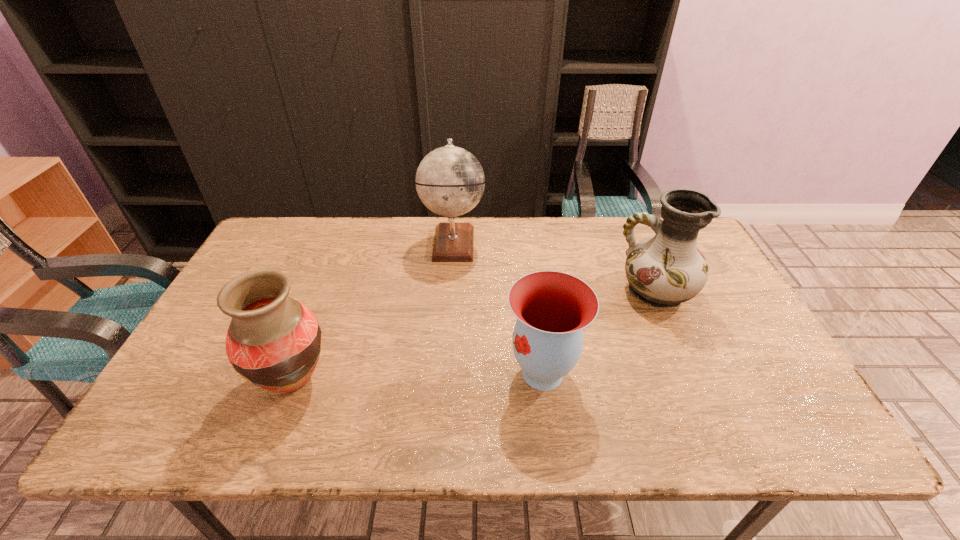
The image size is (960, 540). Identify the location of empty space between the farthest object and the leftmost vase. (373, 312).

Identify the location of vacant point located between the second object from right to left and the third nearest object. (599, 332).

Find the location of `free space between the leftmost vase and the shortest object`. free space between the leftmost vase and the shortest object is located at coordinates [418, 377].

Image resolution: width=960 pixels, height=540 pixels. In order to click on free spot between the leftmost vase and the globe in this screenshot , I will do `click(373, 312)`.

Locate an element on the screen. This screenshot has width=960, height=540. free area in between the shortest object and the rightmost vase is located at coordinates (599, 332).

Find the location of a particular element. vacant space that is in between the second farthest object and the farthest object is located at coordinates (555, 267).

Locate an element on the screen. This screenshot has width=960, height=540. free spot between the leftmost vase and the farthest object is located at coordinates (373, 312).

Locate an element on the screen. This screenshot has width=960, height=540. unoccupied position between the shortest object and the leftmost object is located at coordinates (418, 377).

At what (x,y) coordinates should I click in order to perform the action: click on vacant area that lies between the farthest vase and the globe. Please return your answer as a coordinate pair (x, y). This screenshot has height=540, width=960. Looking at the image, I should click on (555, 267).

Image resolution: width=960 pixels, height=540 pixels. Identify the location of vacant space that is in between the leftmost object and the rightmost object. (474, 336).